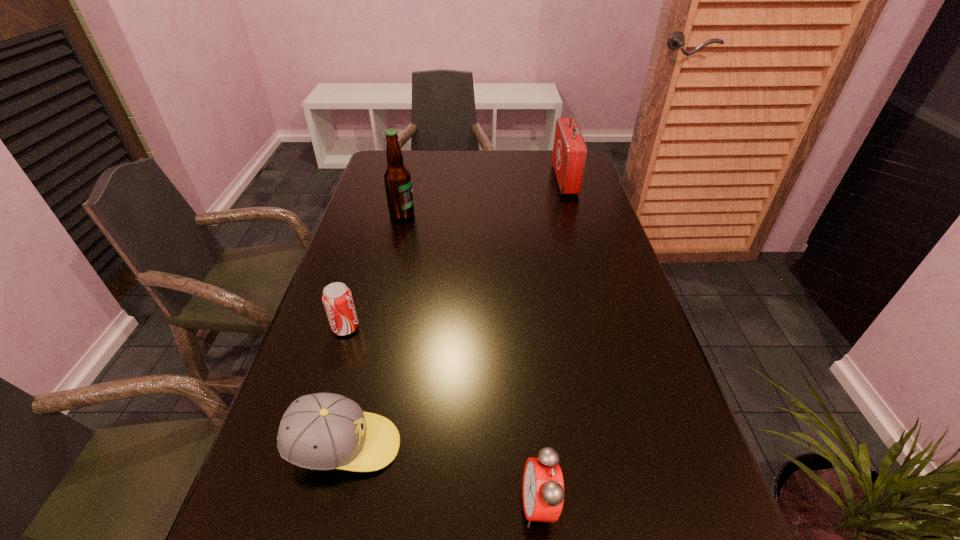
Image resolution: width=960 pixels, height=540 pixels. I want to click on object present at the right edge, so click(x=569, y=155).

What are the coordinates of `object present at the far right corner` in the screenshot? It's located at (569, 155).

At what (x,y) coordinates should I click in order to perform the action: click on vacant space at the far edge of the desktop. Please return your answer as a coordinate pair (x, y). This screenshot has width=960, height=540. Looking at the image, I should click on (444, 176).

Image resolution: width=960 pixels, height=540 pixels. In the image, there is a desktop. In order to click on vacant space at the left edge in this screenshot , I will do `click(389, 283)`.

Find the location of `blank area at the right edge`. blank area at the right edge is located at coordinates (580, 265).

Find the location of a particular element. This screenshot has width=960, height=540. vacant space at the far left corner of the desktop is located at coordinates coord(402,150).

Locate an element on the screen. The image size is (960, 540). vacant area that lies between the farthest object and the third farthest object is located at coordinates pyautogui.click(x=455, y=254).

Locate an element on the screen. vacant area between the second object from right to left and the first-aid kit is located at coordinates (552, 342).

Locate an element on the screen. empty location between the fourth nearest object and the first-aid kit is located at coordinates (484, 197).

Identify the location of vacant area between the fourth object from left to right and the farthest object. (552, 342).